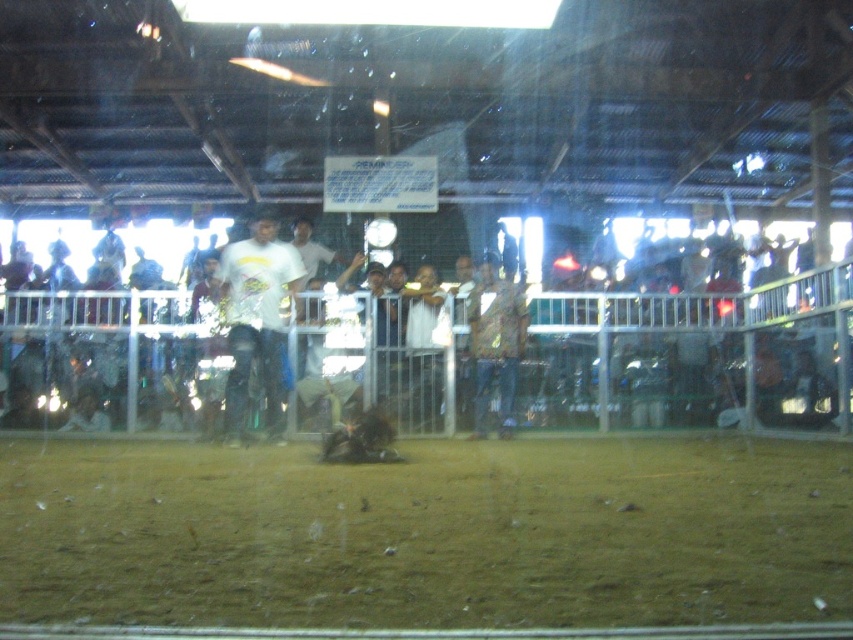
You are standing at the point marked as point (427, 532) in the arena. What surface are you currently standing on?

The point (427, 532) is on brown dirt track at center, so you are standing on the brown dirt track at center.